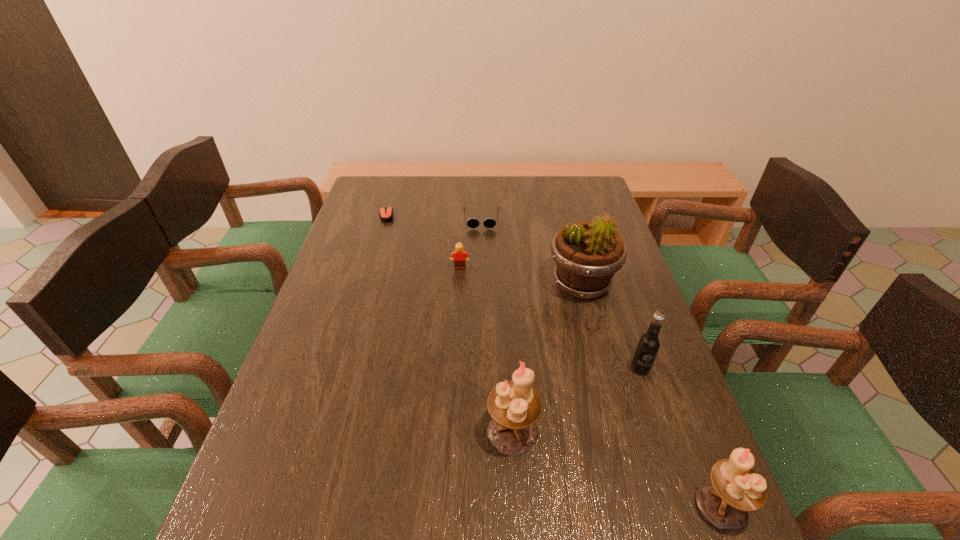
Given the evenly spaced candle holders in the image, where should an extra candle holder be added on the left to preserve the spacing? Please point to a vacant space. Please provide its 2D coordinates. Your answer should be formatted as a tuple, i.e. [(x, y)], where the tuple contains the x and y coordinates of a point satisfying the conditions above.

[(348, 374)]